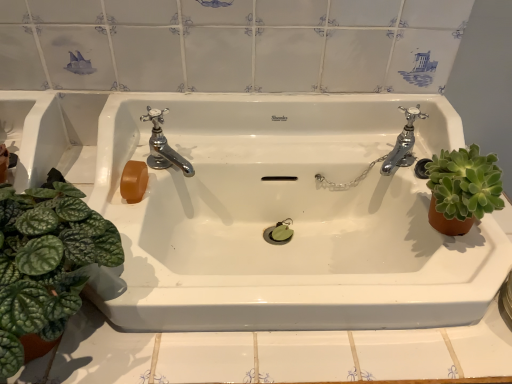
Find the location of a particular element. vacant region in front of green succulent at right, placed as the second houseplant when sorted from left to right is located at coordinates (438, 342).